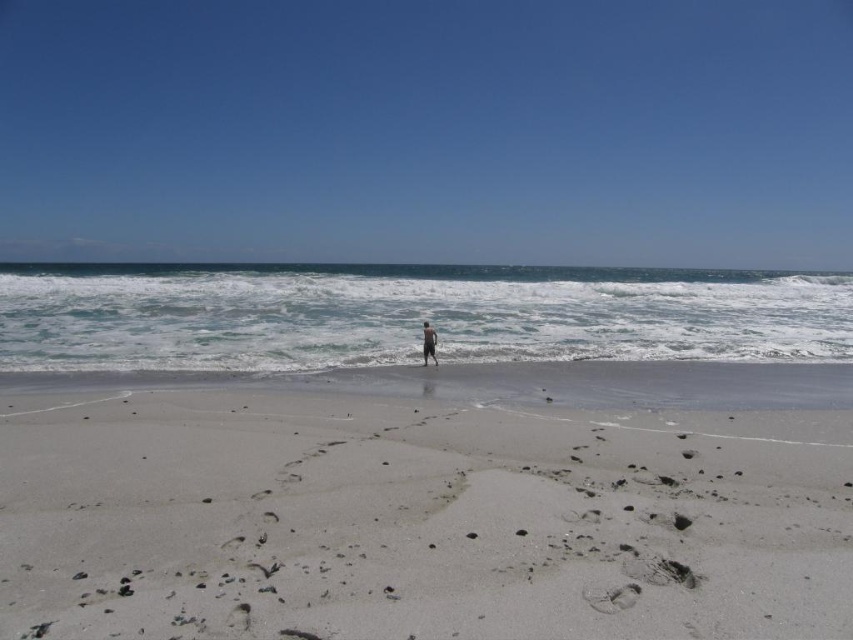
Question: Which object is farther from the camera taking this photo?

Choices:
 (A) white sandy beach at center
 (B) tan skin person at center

Answer: (B)

Question: Which of the following is the closest to the observer?

Choices:
 (A) (735, 611)
 (B) (432, 332)

Answer: (A)

Question: Is white sandy beach at center smaller than tan skin person at center?

Choices:
 (A) no
 (B) yes

Answer: (A)

Question: Is the position of white sandy beach at center less distant than that of tan skin person at center?

Choices:
 (A) yes
 (B) no

Answer: (A)

Question: Where is white sandy beach at center located in relation to tan skin person at center in the image?

Choices:
 (A) left
 (B) right

Answer: (A)